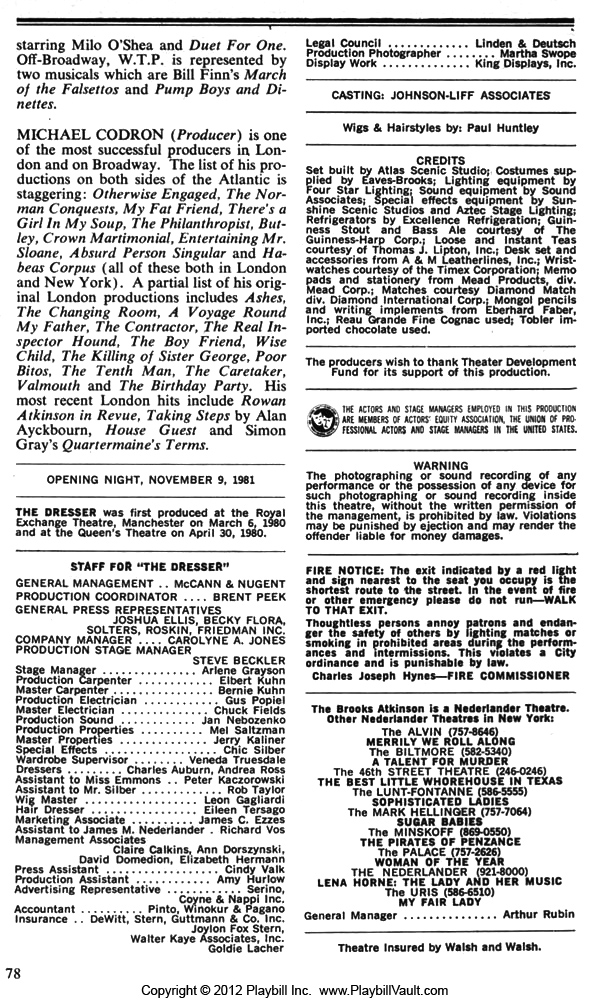
Find the location of `column`. column is located at coordinates (293, 483).